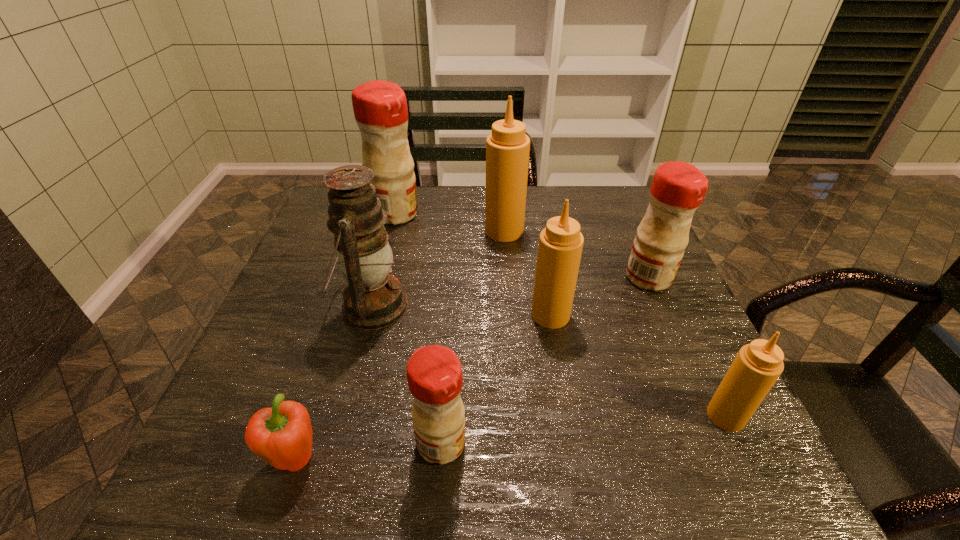
You are a GUI agent. You are given a task and a screenshot of the screen. Output one action in this format:
    pyautogui.click(x=<x>, y=<y>)
    Task: Click on the vacant space positioned 0.220m on the right of the smallest red condiment
    The width and height of the screenshot is (960, 540).
    Given the screenshot: What is the action you would take?
    pyautogui.click(x=593, y=443)

You are a GUI agent. You are given a task and a screenshot of the screen. Output one action in this format:
    pyautogui.click(x=<x>, y=<y>)
    Task: Click on the vacant space located on the back of the pepper
    Image resolution: width=960 pixels, height=540 pixels.
    Given the screenshot: What is the action you would take?
    pyautogui.click(x=338, y=326)

Find the location of a particular element. condiment that is at the near edge is located at coordinates (434, 373).

Identify the location of pepper located at the near edge. This screenshot has width=960, height=540. (281, 435).

Where is `condiment that is at the left edge`? condiment that is at the left edge is located at coordinates (380, 108).

I want to click on lantern at the left edge, so click(x=373, y=299).

This screenshot has width=960, height=540. I want to click on pepper that is at the left edge, so click(281, 435).

Identify the location of object located at the far left corner. This screenshot has width=960, height=540. (380, 108).

The height and width of the screenshot is (540, 960). I want to click on object situated at the near left corner, so click(281, 435).

Locate an element on the screen. Image resolution: width=960 pixels, height=540 pixels. vacant region at the far edge is located at coordinates (539, 191).